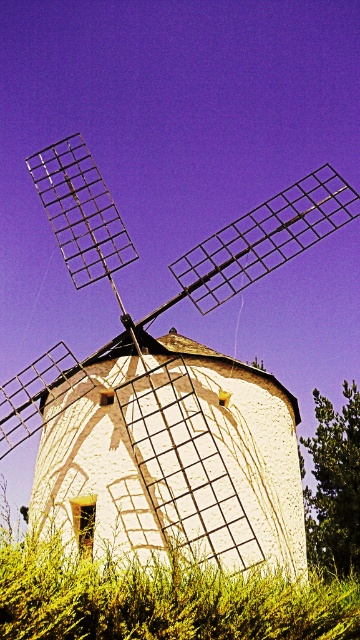
Where is `white matte windmill at center`? The width and height of the screenshot is (360, 640). white matte windmill at center is located at coordinates 167,388.

Does white matte windmill at center have a smaller size compared to green leafy grass at lower center?

No.

Who is more forward, (128, 321) or (167, 580)?

Point (167, 580)

Locate an element on the screen. The width and height of the screenshot is (360, 640). white matte windmill at center is located at coordinates (167, 388).